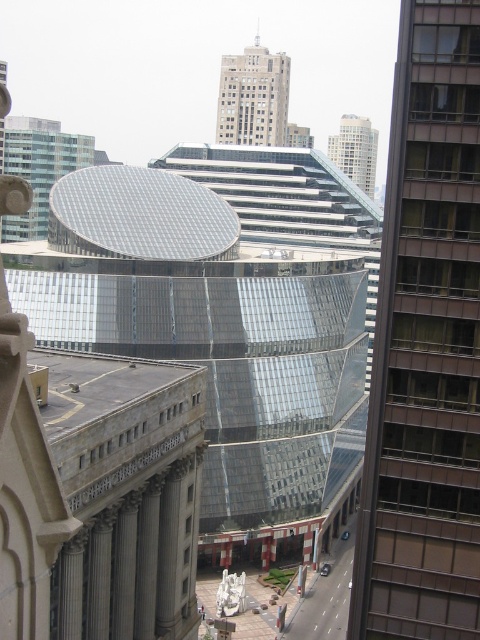
Which is more to the right, gray concrete skyscraper at center or gray stone column at center?

From the viewer's perspective, gray concrete skyscraper at center appears more on the right side.

Does gray concrete skyscraper at center appear over gray stone column at center?

Yes, gray concrete skyscraper at center is above gray stone column at center.

Where is `gray concrete skyscraper at center`? This screenshot has height=640, width=480. gray concrete skyscraper at center is located at coordinates (253, 97).

In the scene shown: Does glassy reflective skyscraper at right appear on the right side of dark gray stone column at center?

Indeed, glassy reflective skyscraper at right is positioned on the right side of dark gray stone column at center.

Does glassy reflective skyscraper at right appear on the left side of dark gray stone column at center?

In fact, glassy reflective skyscraper at right is to the right of dark gray stone column at center.

This screenshot has width=480, height=640. I want to click on glassy reflective skyscraper at right, so pos(425,346).

Can you confirm if glassy reflective skyscraper at right is positioned to the left of gray stone column at lower left?

In fact, glassy reflective skyscraper at right is to the right of gray stone column at lower left.

Does glassy reflective skyscraper at right appear under gray stone column at lower left?

Incorrect, glassy reflective skyscraper at right is not positioned below gray stone column at lower left.

Which is behind, point (397, 580) or point (108, 605)?

The point (108, 605) is behind.

Find the location of `glassy reflective skyscraper at right`. glassy reflective skyscraper at right is located at coordinates (425, 346).